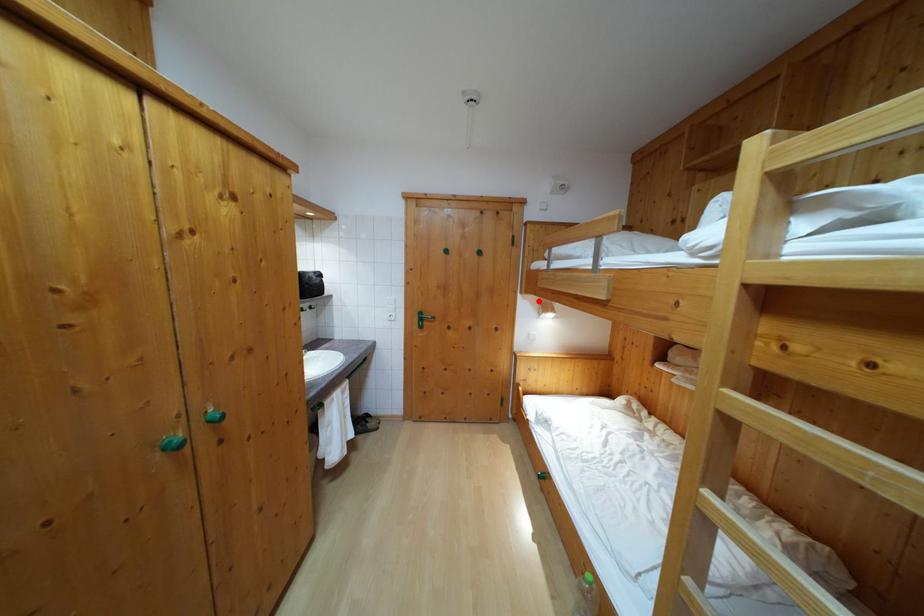
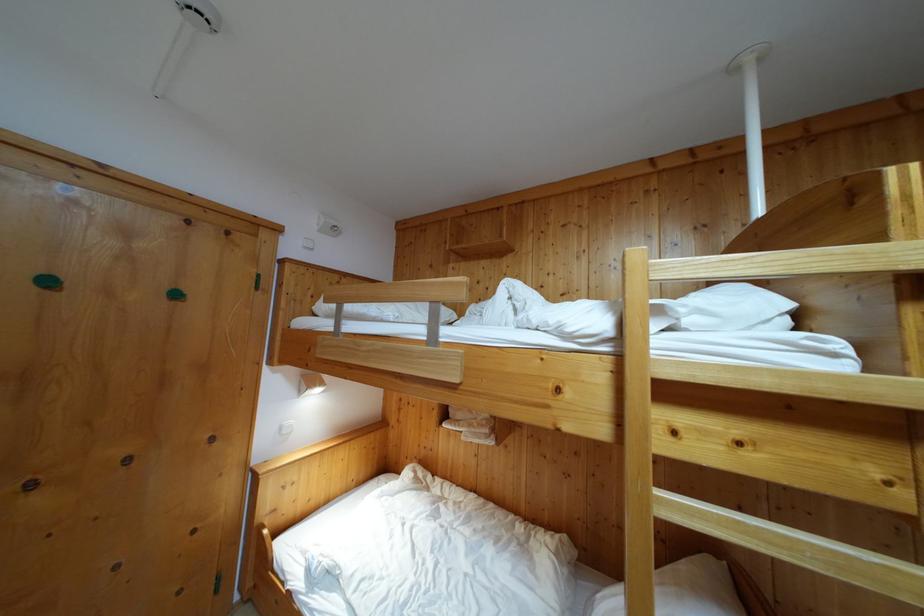
Where in the second image is the point corresponding to the highlighted location from the first image?

(310, 374)